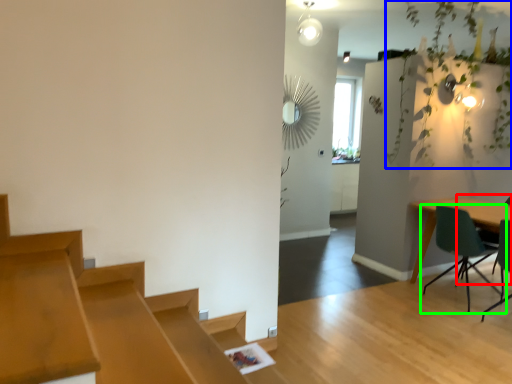
Question: Which is farther away from armchair (highlighted by a red box)? vegetation (highlighted by a blue box) or chair (highlighted by a green box)?

Choices:
 (A) vegetation
 (B) chair

Answer: (A)